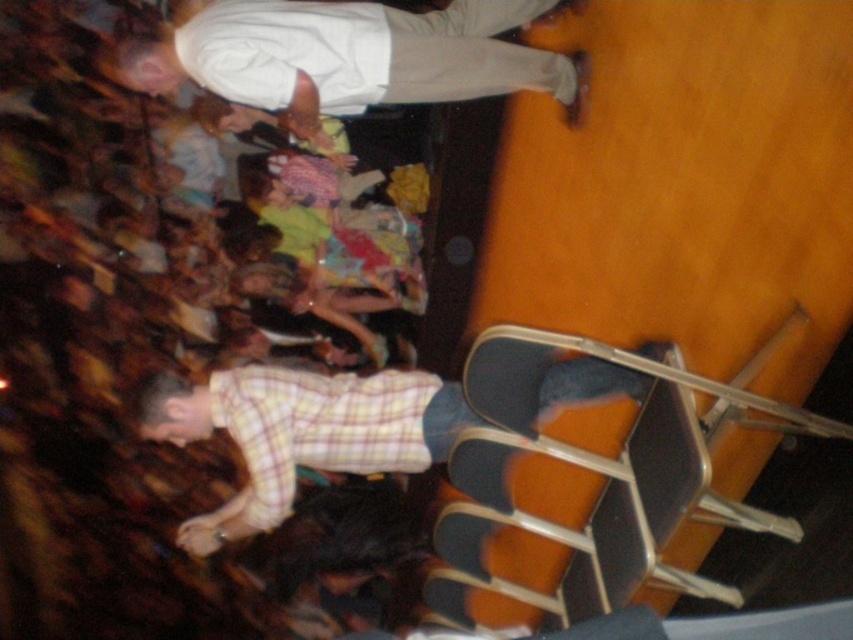
Question: Which of these objects is positioned closest to the light beige pants at upper center?

Choices:
 (A) black plastic chair at lower right
 (B) yellow plaid shirt at lower left

Answer: (B)

Question: Which point appears farthest from the camera in this image?

Choices:
 (A) (694, 593)
 (B) (384, 374)
 (C) (260, 451)
 (D) (259, 74)

Answer: (B)

Question: Does yellow plaid shirt at center have a smaller size compared to yellow plaid shirt at lower left?

Choices:
 (A) no
 (B) yes

Answer: (A)

Question: Is light beige pants at upper center wider than yellow plaid shirt at lower left?

Choices:
 (A) no
 (B) yes

Answer: (B)

Question: Which is farther from the black plastic chair at lower right?

Choices:
 (A) yellow plaid shirt at lower left
 (B) light beige pants at upper center

Answer: (B)

Question: Can you confirm if black plastic chair at lower right is positioned to the right of yellow plaid shirt at center?

Choices:
 (A) no
 (B) yes

Answer: (B)